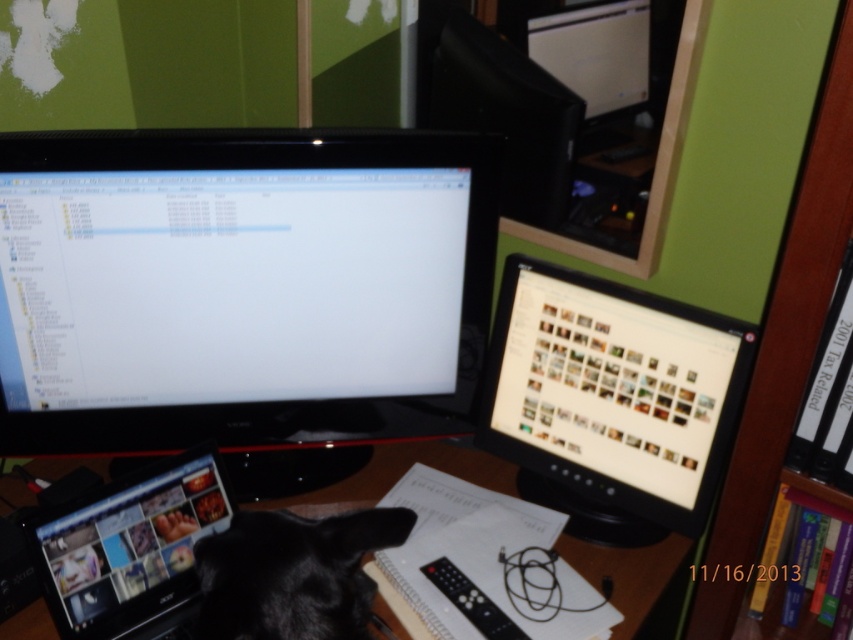
You are trying to clean the monitors in the workspace. You have a cloth that can only reach the monitor that is closest to you. Which monitor should you clean first, the black glossy monitor at center or the matte black monitor at center?

The black glossy monitor at center is in front of the matte black monitor at center, so you should clean the black glossy monitor at center first since it is closer to you.

You are a photographer trying to set up a tripod in this workspace. There are two points marked on the desk where you need to place equipment. The first point is at coordinate point (56, 362) and the second point is at coordinate point (598, 320). Which point is closer to your current position as you stand in front of the desk?

Point (56, 362) is closer to the camera than point (598, 320), so the first point is closer to your current position.

You are a delivery person who needs to place a 10 inch wide package between the black glossy monitor at center and the matte black monitor at center. Can you fit it there?

The distance between the black glossy monitor at center and the matte black monitor at center is 10.74 inches. Since the package is 10 inches wide, it can fit between them with a small amount of space remaining.